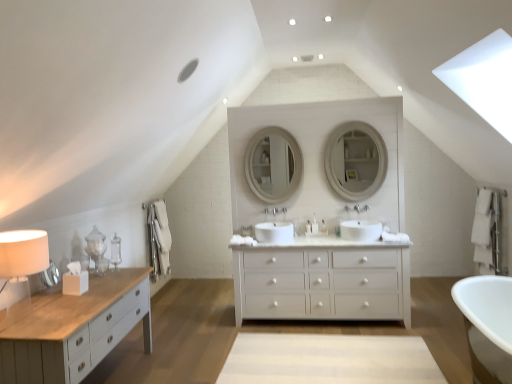
Question: Can you confirm if white glossy faucet at center, the first faucet viewed from the left, is thinner than white glossy mirror at center, acting as the second mirror starting from the right?

Choices:
 (A) yes
 (B) no

Answer: (B)

Question: From a real-world perspective, does white glossy faucet at center, the second faucet positioned from the right, sit lower than white glossy mirror at center, acting as the second mirror starting from the right?

Choices:
 (A) no
 (B) yes

Answer: (B)

Question: From the image's perspective, does white glossy faucet at center, the second faucet positioned from the right, appear lower than white glossy mirror at center, acting as the second mirror starting from the right?

Choices:
 (A) yes
 (B) no

Answer: (A)

Question: Is white glossy faucet at center, the first faucet viewed from the left, bigger than white glossy mirror at center, the first mirror in the left-to-right sequence?

Choices:
 (A) yes
 (B) no

Answer: (B)

Question: Is the position of white glossy faucet at center, the second faucet positioned from the right, less distant than that of white glossy mirror at center, acting as the second mirror starting from the right?

Choices:
 (A) yes
 (B) no

Answer: (A)

Question: Is white glossy faucet at center, the second faucet positioned from the right, wider or thinner than white glossy soap dispenser at center, marked as the 1th toiletry in a left-to-right arrangement?

Choices:
 (A) wide
 (B) thin

Answer: (A)

Question: From a real-world perspective, is white glossy faucet at center, the first faucet viewed from the left, physically located above or below white glossy soap dispenser at center, marked as the 1th toiletry in a left-to-right arrangement?

Choices:
 (A) below
 (B) above

Answer: (B)

Question: Is white glossy faucet at center, the first faucet viewed from the left, inside or outside of white glossy soap dispenser at center, which is counted as the 3th toiletry, starting from the right?

Choices:
 (A) inside
 (B) outside

Answer: (B)

Question: Considering the positions of point (271, 208) and point (293, 225), is point (271, 208) closer or farther from the camera than point (293, 225)?

Choices:
 (A) closer
 (B) farther

Answer: (B)

Question: Which is correct: white ceramic faucet at center, marked as the first faucet in a right-to-left arrangement, is inside white fabric lampshade at left, or outside of it?

Choices:
 (A) outside
 (B) inside

Answer: (A)

Question: From the image's perspective, relative to white fabric lampshade at left, is white ceramic faucet at center, which is counted as the 2th faucet, starting from the left, above or below?

Choices:
 (A) below
 (B) above

Answer: (B)

Question: Based on their sizes in the image, would you say white ceramic faucet at center, marked as the first faucet in a right-to-left arrangement, is bigger or smaller than white fabric lampshade at left?

Choices:
 (A) big
 (B) small

Answer: (B)

Question: Relative to white fabric lampshade at left, is white ceramic faucet at center, which is counted as the 2th faucet, starting from the left, in front or behind?

Choices:
 (A) behind
 (B) front

Answer: (A)

Question: From a real-world perspective, is white glossy mirror at center, the first mirror in the left-to-right sequence, positioned above or below white matte chest of drawers at center?

Choices:
 (A) below
 (B) above

Answer: (B)

Question: Looking at their shapes, would you say white glossy mirror at center, acting as the second mirror starting from the right, is wider or thinner than white matte chest of drawers at center?

Choices:
 (A) wide
 (B) thin

Answer: (B)